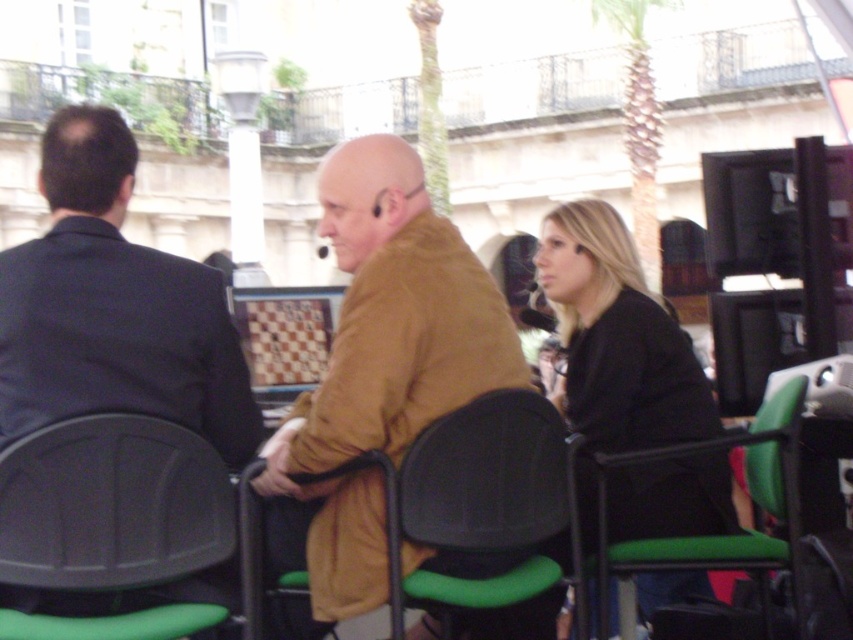
You are standing at the point marked by the coordinates (113, 307) in the image. What object is located at this point?

The point at coordinates (113, 307) indicates the dark blue suit at left.

You are sitting at a table in the scene. You notice a dark blue suit at left and a black plastic chair at center. Which object is closer to your left side?

The dark blue suit at left is closer to your left side since it is positioned to the left of the black plastic chair at center.

You are standing at the viewer position in the scene. There is a point marked at coordinates point (630, 349). Can you reach that point by walking straight ahead without changing direction?

The distance between point (630, 349) and the viewer is 27.46 meters, so yes, you can reach that point by walking straight ahead without changing direction since there is a clear path.